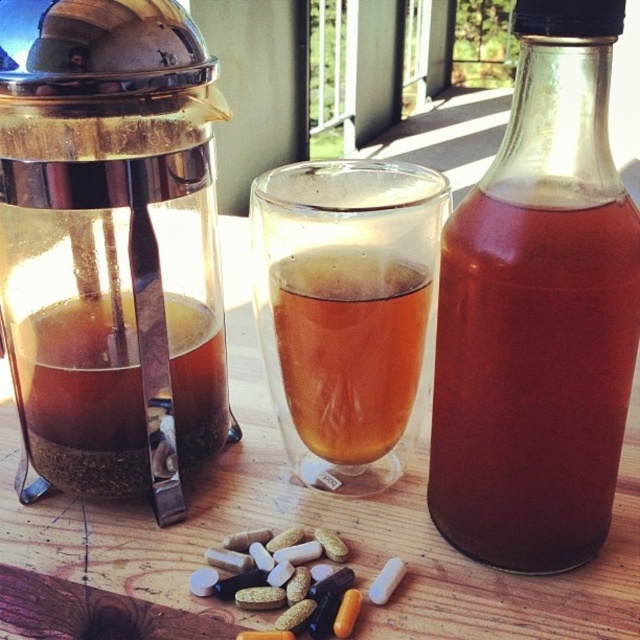
You are arranging items on a table and need to place the translucent glass bottle at center and the translucent glass tea at left. According to the scene, which item is positioned higher relative to the other?

The translucent glass bottle at center is above the translucent glass tea at left.

You are a barista trying to arrange the transparent glass coffee maker at left and the translucent glass cup at center for a customer. The customer wants the two items to be at least 3 inches apart. Can you achieve this with their current placement?

The transparent glass coffee maker at left and translucent glass cup at center are currently 2.49 inches apart, which is less than the required 3 inches. Therefore, you need to move them further apart to meet the customer request.

Based on the photo, you are standing in front of the table and want to pick up an item. Which of the two points, point (580, 525) or point (112, 378), is closer to you?

Point (580, 525) is closer to the camera than point (112, 378), so it is closer to you.